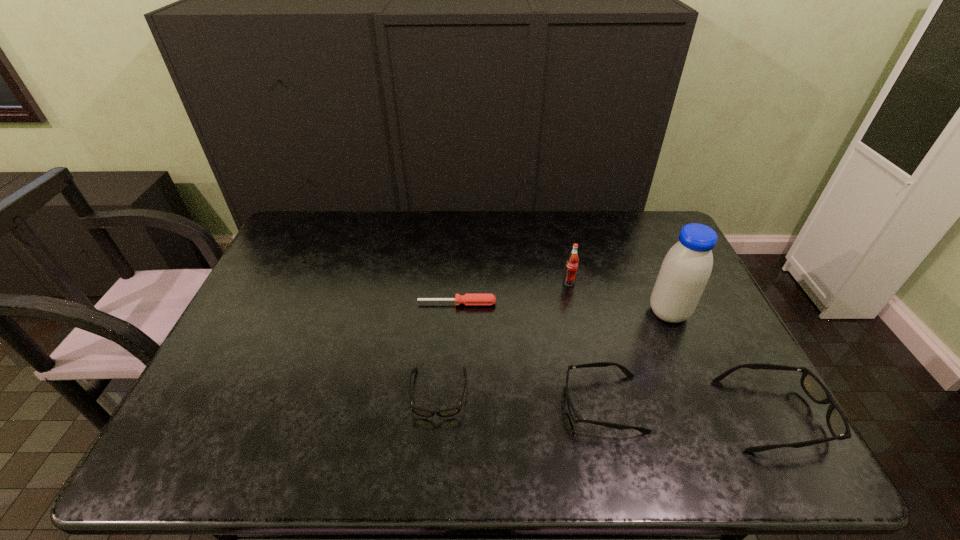
Find the location of a particular element. The height and width of the screenshot is (540, 960). vacant space at the near edge of the desktop is located at coordinates (503, 423).

This screenshot has height=540, width=960. I want to click on vacant area at the left edge, so click(300, 296).

Identify the location of vacant area at the right edge of the desktop. This screenshot has width=960, height=540. (648, 274).

Where is `blank area at the far left corner`? blank area at the far left corner is located at coordinates (325, 217).

You are a GUI agent. You are given a task and a screenshot of the screen. Output one action in this format:
    pyautogui.click(x=<x>, y=<y>)
    Task: Click on the free space between the soda bottle and the screwdriver
    This screenshot has height=540, width=960.
    Given the screenshot: What is the action you would take?
    pyautogui.click(x=513, y=293)

The height and width of the screenshot is (540, 960). What are the coordinates of `empty space that is in between the fourth shortest object and the farthest object` in the screenshot? It's located at (672, 348).

Identify the location of free space that is in between the second shortest object and the rightmost spectacles. (607, 404).

Identify the location of vacant area that lies between the shortest object and the third shortest object. (530, 354).

Find the location of `free space between the screwdriver and the second shortest spectacles`. free space between the screwdriver and the second shortest spectacles is located at coordinates pos(530,354).

Image resolution: width=960 pixels, height=540 pixels. I want to click on unoccupied area between the tallest object and the second spectacles from left to right, so click(x=636, y=358).